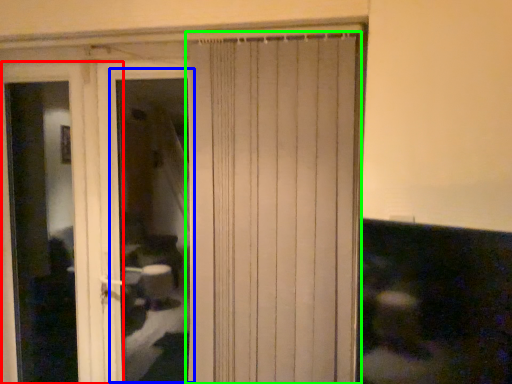
Question: Based on their relative distances, which object is nearer to screen door (highlighted by a red box)? Choose from window (highlighted by a blue box) and curtain (highlighted by a green box).

Choices:
 (A) window
 (B) curtain

Answer: (B)